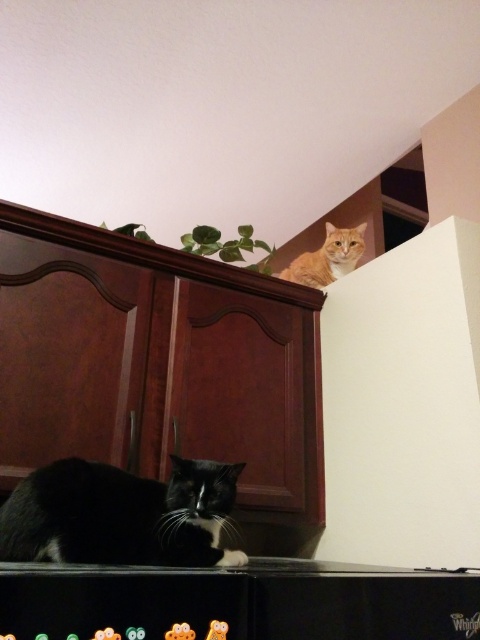
You are a photographer trying to capture both the brown wood dresser at center and the orange fur cat at upper right in the same frame. Which object is positioned closer to the camera?

The brown wood dresser at center is closer to the viewer than the orange fur cat at upper right, so it will appear closer to the camera in the photo.

You are a cat owner who wants to buy a new cat bed. The bed you found is 30 cm wide. You see the black fur cat at lower left and the orange fur cat at upper right in the image. Which cat would the bed fit better?

The black fur cat at lower left has a greater width than the orange fur cat at upper right. Since the bed is 30 cm wide, it would fit better for the orange fur cat at upper right as it is narrower.

You are a cat owner who wants to place a new cat tree in the living room. The cat tree is 1.2 meters tall. You have two cats, a black fur cat at lower left and an orange fur cat at upper right. Which cat is more likely to reach the top of the cat tree?

The orange fur cat at upper right is taller than the black fur cat at lower left, so it is more likely to reach the top of the 1.2 meter tall cat tree.